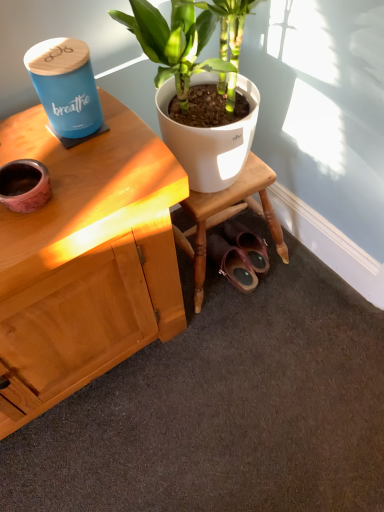
Question: Do you think leather/matte sandals at lower center is within pink marble flowerpot at left, or outside of it?

Choices:
 (A) inside
 (B) outside

Answer: (B)

Question: Based on their sizes in the image, would you say leather/matte sandals at lower center is bigger or smaller than pink marble flowerpot at left?

Choices:
 (A) big
 (B) small

Answer: (A)

Question: From a real-world perspective, relative to pink marble flowerpot at left, is leather/matte sandals at lower center vertically above or below?

Choices:
 (A) below
 (B) above

Answer: (A)

Question: Based on their sizes in the image, would you say pink marble flowerpot at left is bigger or smaller than leather/matte sandals at lower center?

Choices:
 (A) big
 (B) small

Answer: (B)

Question: Does point (3, 166) appear closer or farther from the camera than point (225, 264)?

Choices:
 (A) closer
 (B) farther

Answer: (A)

Question: Do you think pink marble flowerpot at left is within leather/matte sandals at lower center, or outside of it?

Choices:
 (A) outside
 (B) inside

Answer: (A)

Question: Is pink marble flowerpot at left taller or shorter than leather/matte sandals at lower center?

Choices:
 (A) short
 (B) tall

Answer: (A)